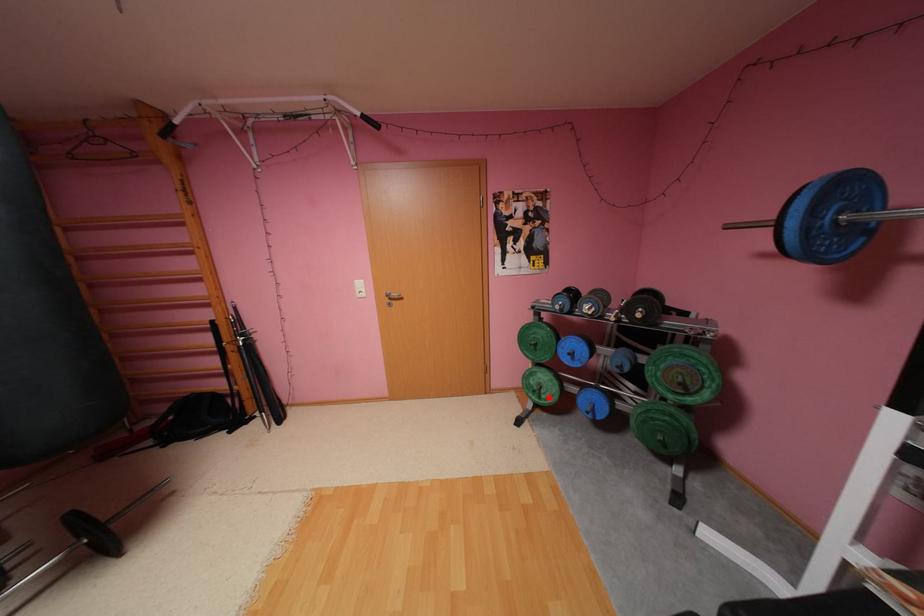
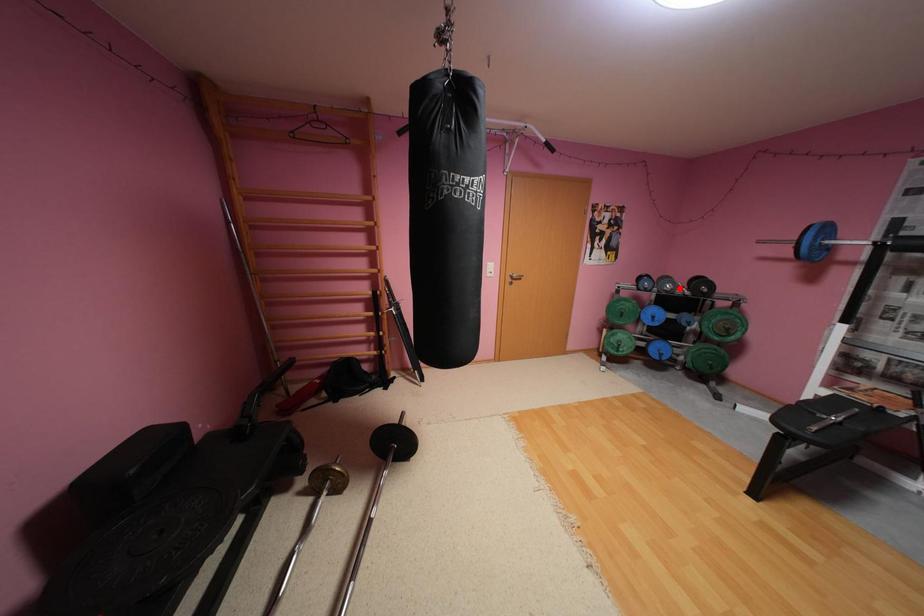
I am providing you with two images of the same scene from different viewpoints. A red point is marked on the first image and another point is marked on the second image. Is the red point in image1 aligned with the point shown in image2?

No